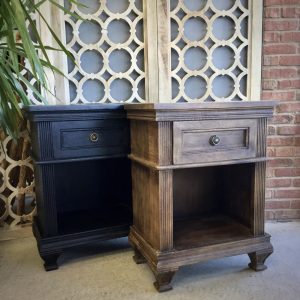
In order to click on knob in this screenshot , I will do `click(94, 137)`.